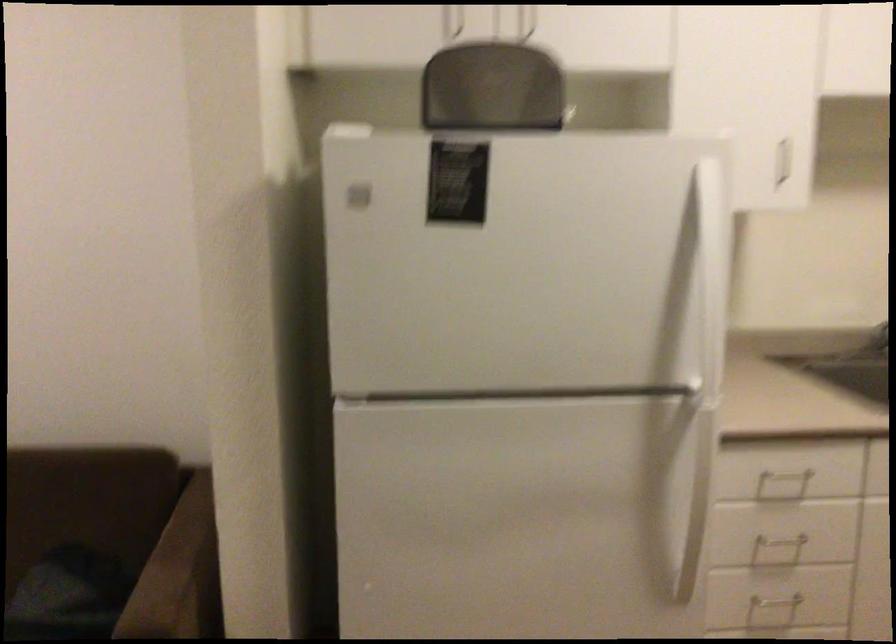
I want to click on refrigerator door handle, so [687, 495].